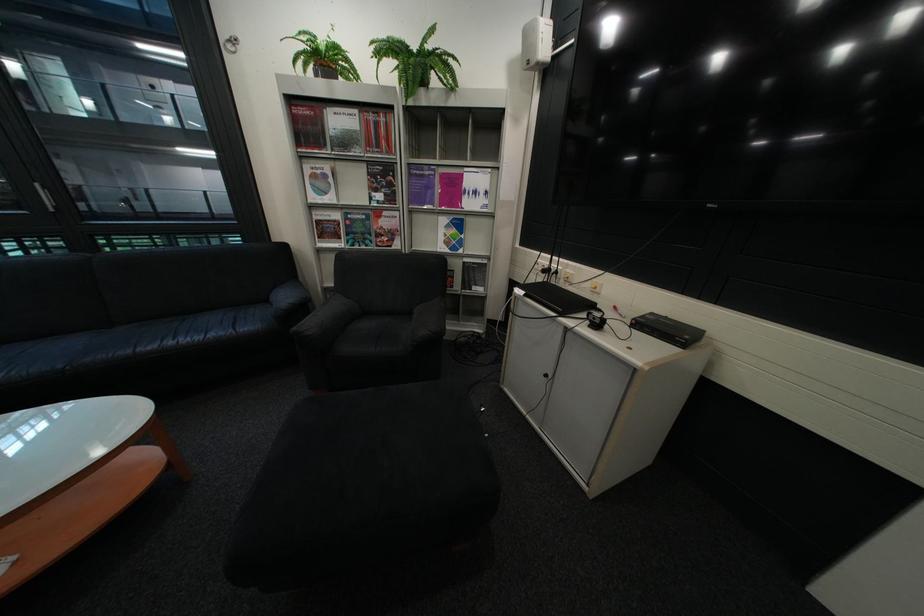
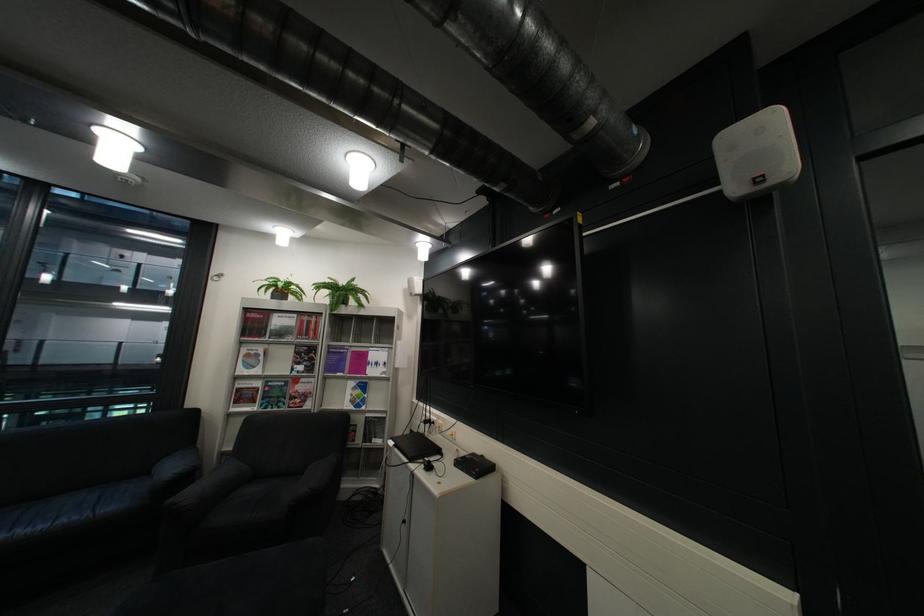
The point at (334,222) is marked in the first image. Where is the corresponding point in the second image?

(254, 390)